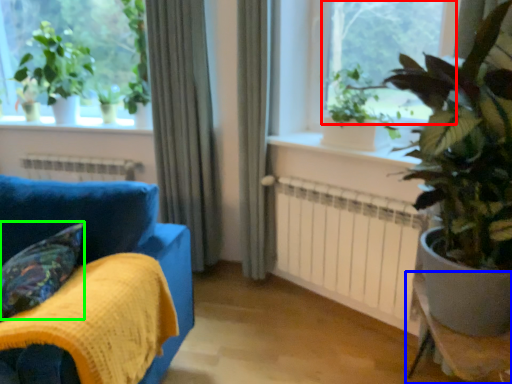
Question: Which is farther away from window screen (highlighted by a red box)? table (highlighted by a blue box) or pillow (highlighted by a green box)?

Choices:
 (A) table
 (B) pillow

Answer: (B)